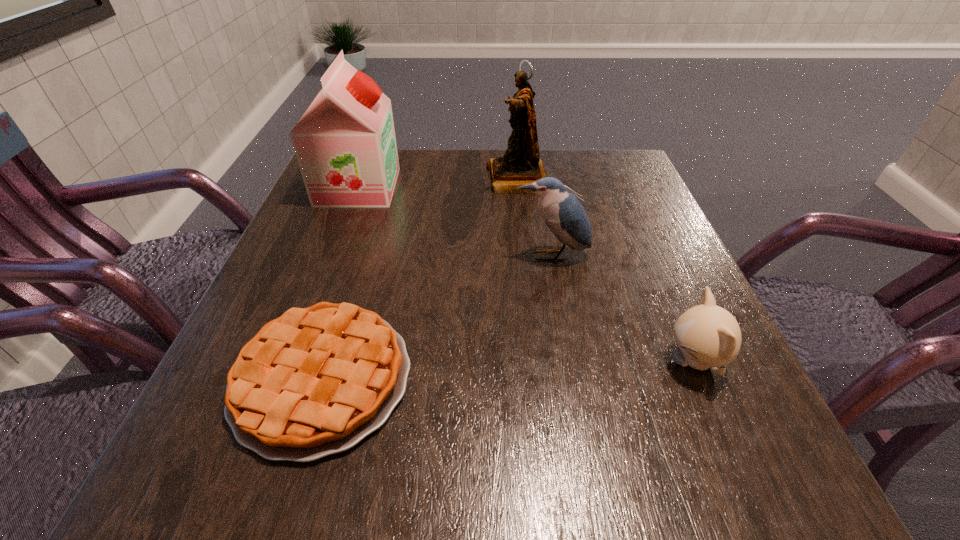
I want to click on unoccupied area between the pie and the third shortest object, so click(x=437, y=317).

The image size is (960, 540). In order to click on free space between the pie and the soya milk in this screenshot , I will do `click(340, 283)`.

Image resolution: width=960 pixels, height=540 pixels. Identify the location of vacant region between the shortest object and the soya milk. (340, 283).

This screenshot has height=540, width=960. In order to click on free space between the pie and the second shortest object in this screenshot , I will do `click(508, 370)`.

Where is `vacant space that is in between the figurine and the soya milk`? The height and width of the screenshot is (540, 960). vacant space that is in between the figurine and the soya milk is located at coordinates (438, 183).

Locate an element on the screen. free space between the figurine and the second shortest object is located at coordinates (606, 271).

You are a GUI agent. You are given a task and a screenshot of the screen. Output one action in this format:
    pyautogui.click(x=<x>, y=<y>)
    Task: Click on the free space between the rightmost object and the figurine
    
    Given the screenshot: What is the action you would take?
    pyautogui.click(x=606, y=271)

Identify which object is the third closest to the third shortest object. Please provide its 2D coordinates. Your answer should be formatted as a tuple, i.e. [(x, y)], where the tuple contains the x and y coordinates of a point satisfying the conditions above.

[(316, 381)]

Identify which object is the third closest to the third farthest object. Please provide its 2D coordinates. Your answer should be formatted as a tuple, i.e. [(x, y)], where the tuple contains the x and y coordinates of a point satisfying the conditions above.

[(316, 381)]

You are a GUI agent. You are given a task and a screenshot of the screen. Output one action in this format:
    pyautogui.click(x=<x>, y=<y>)
    Task: Click on the vacant space that satisfies the following two spatial constraints: 1. with the cap open on the soya milk; 2. on the right side of the shortest object
    The height and width of the screenshot is (540, 960).
    Given the screenshot: What is the action you would take?
    pyautogui.click(x=285, y=379)